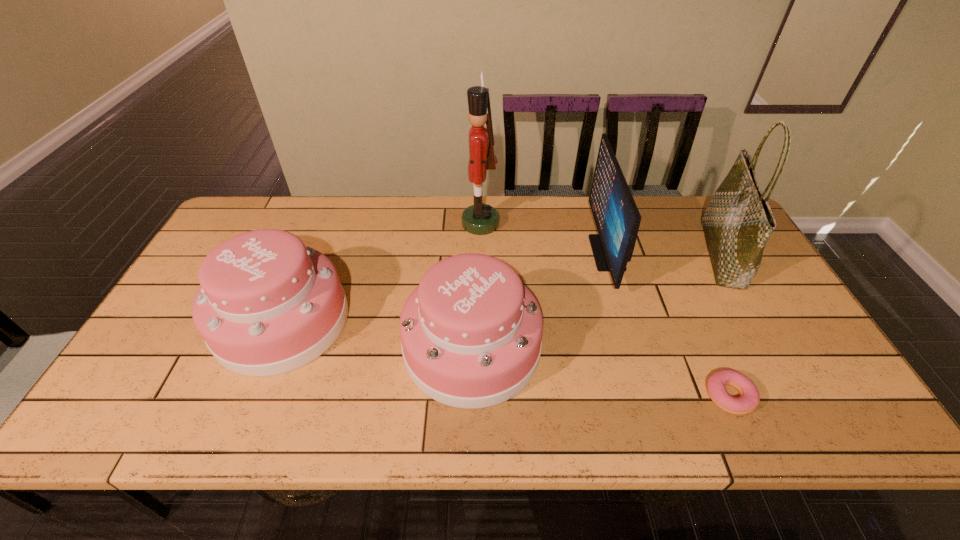
Locate an element on the screen. Image resolution: width=960 pixels, height=540 pixels. blank space at the near right corner is located at coordinates (782, 404).

Find the location of a particular element. The height and width of the screenshot is (540, 960). free space between the nutcracker and the doughnut is located at coordinates (605, 309).

At what (x,y) coordinates should I click in order to perform the action: click on vacant space that's between the computer monitor and the shortest object. Please return your answer as a coordinate pair (x, y). The height and width of the screenshot is (540, 960). Looking at the image, I should click on (668, 324).

You are a GUI agent. You are given a task and a screenshot of the screen. Output one action in this format:
    pyautogui.click(x=<x>, y=<y>)
    Task: Click on the vacant area between the rightmost object and the fourth object from left to right
    The image size is (960, 540).
    Given the screenshot: What is the action you would take?
    pyautogui.click(x=664, y=253)

Locate an element on the screen. This screenshot has height=540, width=960. free area in between the cake and the birthday cake is located at coordinates (377, 334).

This screenshot has height=540, width=960. In order to click on vacant point located between the cake and the computer monitor in this screenshot , I will do `click(540, 300)`.

At what (x,y) coordinates should I click in order to perform the action: click on vacant space in between the fourth object from left to right and the cake. Please return your answer as a coordinate pair (x, y). Looking at the image, I should click on (540, 300).

At what (x,y) coordinates should I click in order to perform the action: click on empty location between the cake and the fourth object from left to right. Please return your answer as a coordinate pair (x, y). The height and width of the screenshot is (540, 960). Looking at the image, I should click on (540, 300).

Locate an element on the screen. vacant area between the rightmost object and the cake is located at coordinates pos(597,301).

I want to click on free space between the shortest object and the rightmost object, so pyautogui.click(x=726, y=325).